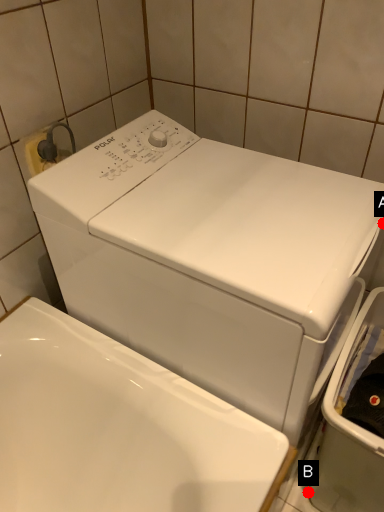
Question: Two points are circled on the image, labeled by A and B beside each circle. Which point appears farthest from the camera in this image?

Choices:
 (A) A is further
 (B) B is further

Answer: (B)